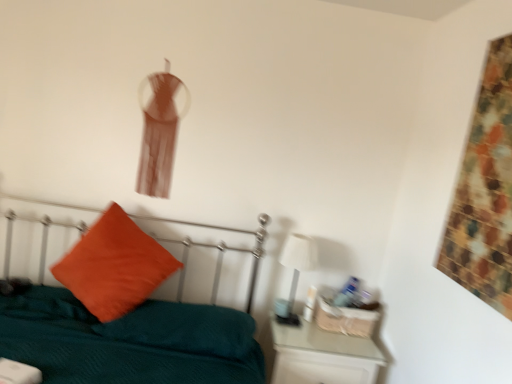
Question: Is orange velvet pillow at left in front of white glossy nightstand at lower right?

Choices:
 (A) yes
 (B) no

Answer: (A)

Question: Is orange velvet pillow at left behind white glossy nightstand at lower right?

Choices:
 (A) no
 (B) yes

Answer: (A)

Question: Considering the relative sizes of orange velvet pillow at left and white glossy nightstand at lower right in the image provided, is orange velvet pillow at left smaller than white glossy nightstand at lower right?

Choices:
 (A) no
 (B) yes

Answer: (A)

Question: From the image's perspective, is orange velvet pillow at left beneath white glossy nightstand at lower right?

Choices:
 (A) no
 (B) yes

Answer: (A)

Question: Is orange velvet pillow at left taller than white glossy nightstand at lower right?

Choices:
 (A) no
 (B) yes

Answer: (B)

Question: Which is correct: white glossy table lamp at right is inside orange velvet pillow at left, or outside of it?

Choices:
 (A) outside
 (B) inside

Answer: (A)

Question: Looking at the image, does white glossy table lamp at right seem bigger or smaller compared to orange velvet pillow at left?

Choices:
 (A) big
 (B) small

Answer: (B)

Question: From the image's perspective, is white glossy table lamp at right above or below orange velvet pillow at left?

Choices:
 (A) below
 (B) above

Answer: (A)

Question: In the image, is white glossy table lamp at right positioned in front of or behind orange velvet pillow at left?

Choices:
 (A) behind
 (B) front

Answer: (A)

Question: From a real-world perspective, relative to teal fabric bed at center, is white glossy table lamp at right vertically above or below?

Choices:
 (A) below
 (B) above

Answer: (B)

Question: Is white glossy table lamp at right spatially inside teal fabric bed at center, or outside of it?

Choices:
 (A) outside
 (B) inside

Answer: (A)

Question: From the image's perspective, is white glossy table lamp at right above or below teal fabric bed at center?

Choices:
 (A) above
 (B) below

Answer: (A)

Question: Would you say white glossy table lamp at right is to the left or to the right of teal fabric bed at center in the picture?

Choices:
 (A) right
 (B) left

Answer: (A)

Question: Is point (14, 336) closer or farther from the camera than point (95, 233)?

Choices:
 (A) closer
 (B) farther

Answer: (A)

Question: In the image, is teal fabric bed at center positioned in front of or behind orange velvet pillow at left?

Choices:
 (A) front
 (B) behind

Answer: (A)